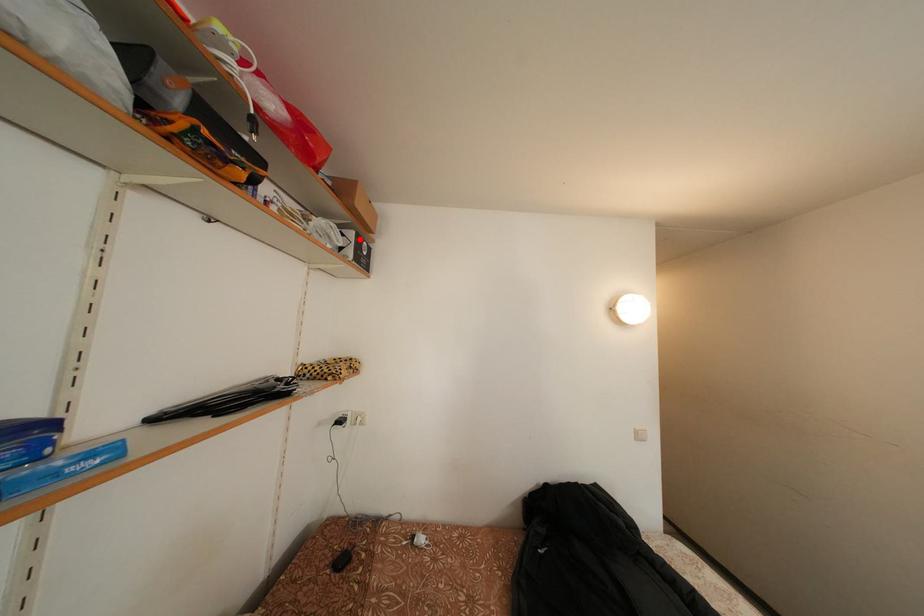
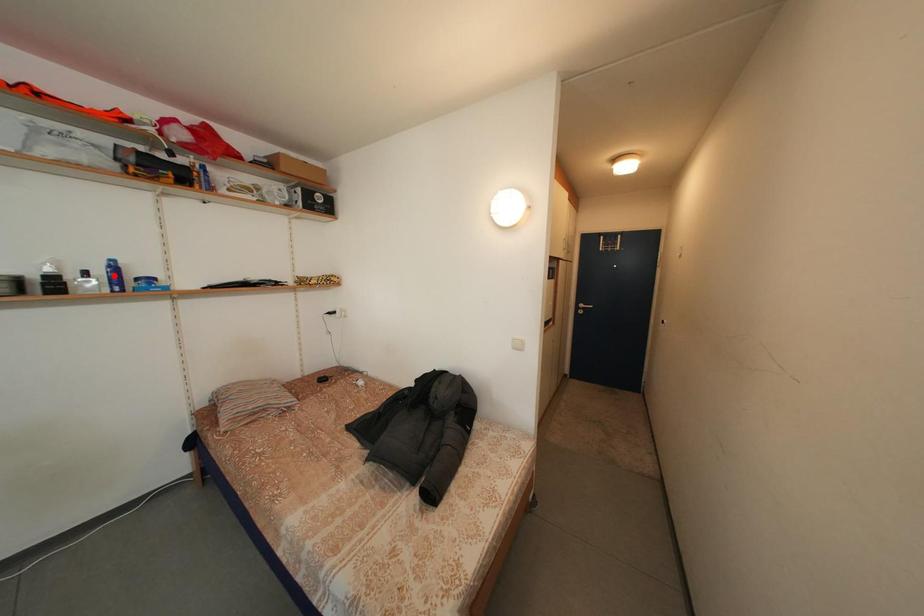
I am providing you with two images of the same scene from different viewpoints. A red point is marked on the first image and another point is marked on the second image. Does the point marked in image1 correspond to the same location as the one in image2?

No